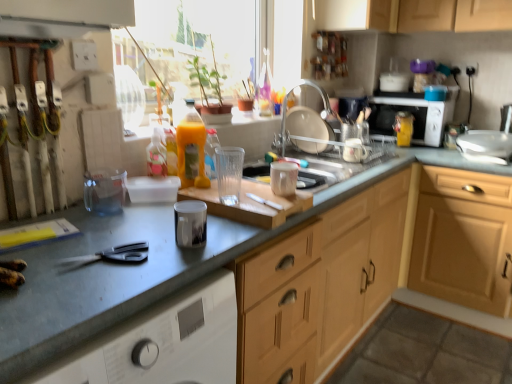
Find the location of a particular element. vacant space behind black plastic scissors at lower left is located at coordinates (122, 230).